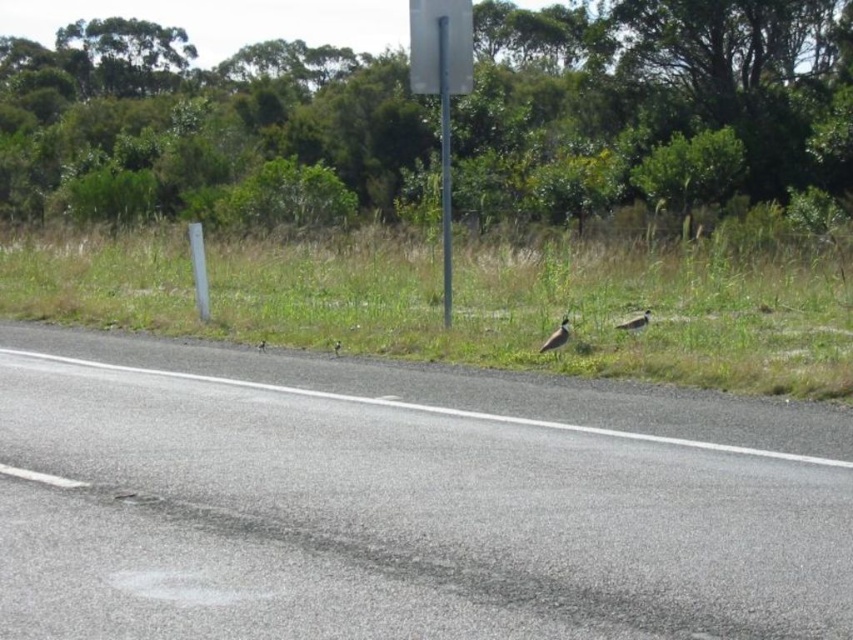
Question: Which of the following is the farthest from the observer?

Choices:
 (A) metallic gray sign at upper center
 (B) brown speckled bird at center-right
 (C) gray asphalt highway at center

Answer: (A)

Question: Can you confirm if metallic gray sign at upper center is bigger than brown speckled feather at center?

Choices:
 (A) yes
 (B) no

Answer: (A)

Question: Does gray asphalt highway at center appear on the right side of brown speckled feather at center?

Choices:
 (A) yes
 (B) no

Answer: (A)

Question: Which point is closer to the camera?

Choices:
 (A) pyautogui.click(x=618, y=324)
 (B) pyautogui.click(x=451, y=56)

Answer: (A)

Question: Among these objects, which one is farthest from the camera?

Choices:
 (A) brown speckled feather at center
 (B) brown feathered bird at center-right
 (C) brown feathered bird at center
 (D) brown speckled bird at center-right

Answer: (C)

Question: In this image, where is brown speckled feather at center located relative to brown feathered bird at center?

Choices:
 (A) above
 (B) below

Answer: (B)